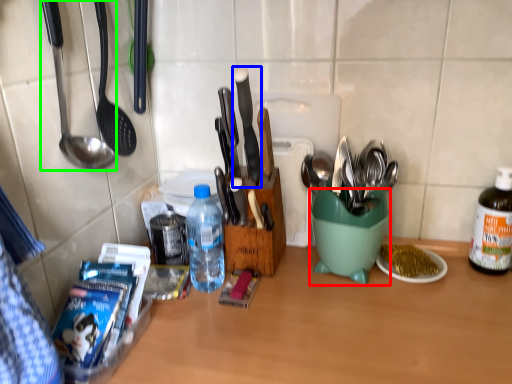
Question: Considering the real-world distances, which object is closest to mixing bowl (highlighted by a red box)? knife (highlighted by a blue box) or spoon (highlighted by a green box).

Choices:
 (A) knife
 (B) spoon

Answer: (A)